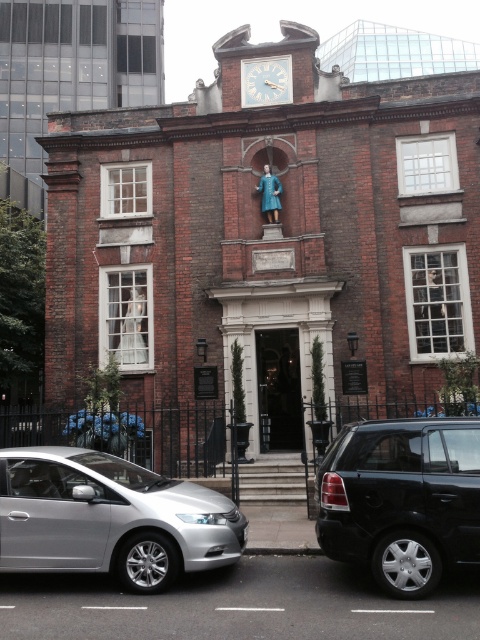
You are a delivery person trying to park your van between the silver metallic car at lower left and the black matte suv at lower right. Your van is 3.2 meters long. Can you fit your van between them?

The distance between the silver metallic car at lower left and the black matte suv at lower right is 1.60 meters. Since your van is 3.2 meters long, which is twice the available space, you cannot fit your van between them.

You are a pedestrian standing at the entrance of the historic brick building. You want to take a photo of the white wooden clock at upper center without the black matte suv at lower right appearing in the frame. Which direction should you move to ensure the suv is out of sight?

The black matte suv at lower right is on the right side of the white wooden clock at upper center. To avoid the suv in your photo, move to the right side of the entrance so the clock is framed away from the suv.